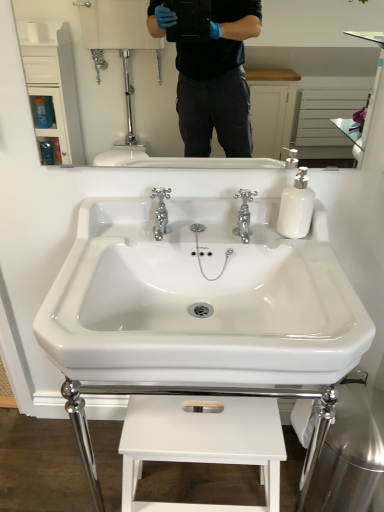
Question: Is white matte stool at lower center inside or outside of chrome metallic faucet at center, the 2th tap from the left?

Choices:
 (A) outside
 (B) inside

Answer: (A)

Question: In the image, is white matte stool at lower center positioned in front of or behind chrome metallic faucet at center, acting as the 1th tap starting from the right?

Choices:
 (A) front
 (B) behind

Answer: (A)

Question: Which object is positioned farthest from the white glossy mirror at upper center?

Choices:
 (A) white matte stool at lower center
 (B) chrome metallic faucet at center, the 2th tap from the left
 (C) chrome metallic faucet at center, arranged as the first tap when viewed from the left
 (D) white glossy soap dispenser at right
 (E) white glossy sink at center

Answer: (A)

Question: Estimate the real-world distances between objects in this image. Which object is farther from the chrome metallic faucet at center, acting as the 1th tap starting from the right?

Choices:
 (A) white glossy mirror at upper center
 (B) white matte stool at lower center
 (C) white glossy sink at center
 (D) white glossy soap dispenser at right
 (E) chrome metallic faucet at center, arranged as the first tap when viewed from the left

Answer: (A)